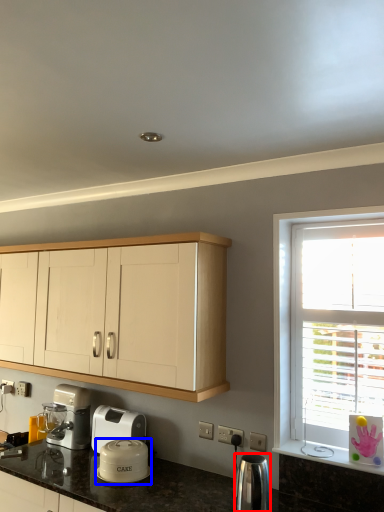
Question: Which object is further to the camera taking this photo, kitchen appliance (highlighted by a red box) or kitchen appliance (highlighted by a blue box)?

Choices:
 (A) kitchen appliance
 (B) kitchen appliance

Answer: (B)